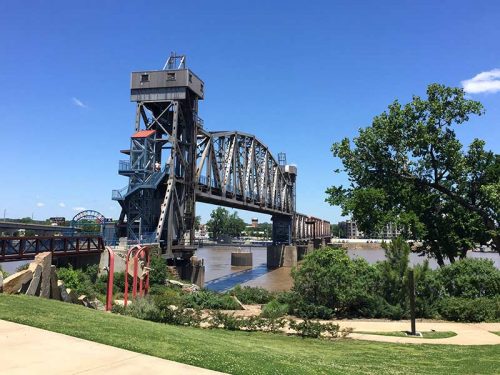
I want to click on archway, so click(93, 216).